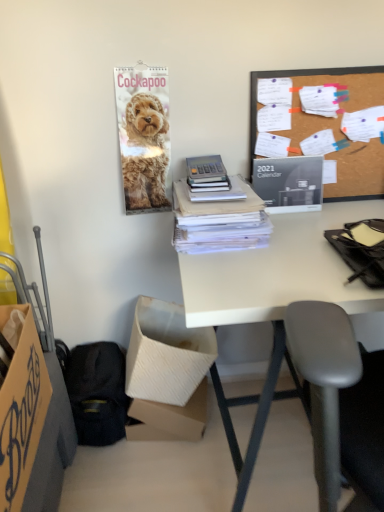
This screenshot has height=512, width=384. What are the coordinates of `free point above white matte desk at center (from a real-world perspective)` in the screenshot? It's located at (298, 245).